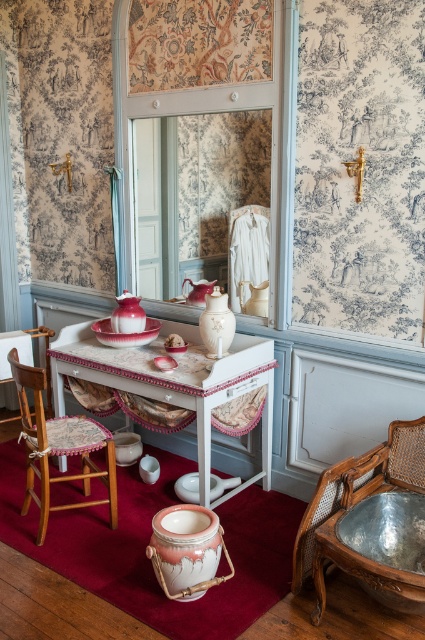
Question: Which object is farther from the camera taking this photo?

Choices:
 (A) wooden cane armchair at lower right
 (B) white glossy vanity at center
 (C) wooden chair with cushion at left

Answer: (B)

Question: Which of these objects is positioned farthest from the white glossy vanity at center?

Choices:
 (A) wooden chair with cushion at left
 (B) wooden cane armchair at lower right

Answer: (B)

Question: Can you confirm if white glossy vanity at center is wider than wooden cane armchair at lower right?

Choices:
 (A) yes
 (B) no

Answer: (A)

Question: From the image, what is the correct spatial relationship of wooden cane armchair at lower right in relation to wooden chair with cushion at left?

Choices:
 (A) right
 (B) left

Answer: (A)

Question: Estimate the real-world distances between objects in this image. Which object is closer to the wooden cane armchair at lower right?

Choices:
 (A) wooden chair with cushion at left
 (B) white glossy vanity at center

Answer: (B)

Question: Is white glossy vanity at center positioned behind wooden chair with cushion at left?

Choices:
 (A) yes
 (B) no

Answer: (A)